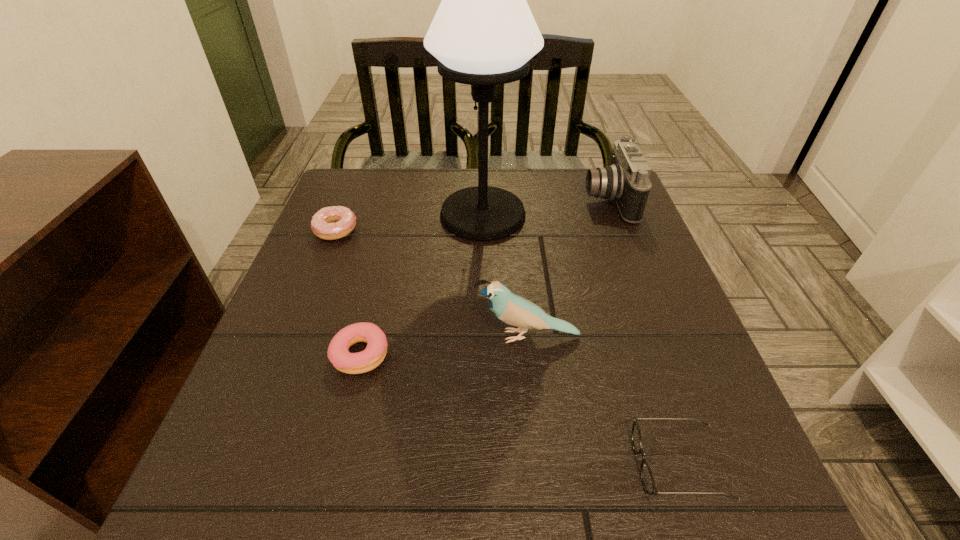
The image size is (960, 540). I want to click on the tallest object, so click(x=483, y=34).

Image resolution: width=960 pixels, height=540 pixels. I want to click on camera, so click(626, 182).

Find the location of a particular element. bird is located at coordinates (514, 310).

You are a GUI agent. You are given a task and a screenshot of the screen. Output one action in this format:
    pyautogui.click(x=<x>, y=<y>)
    Task: Click on the leftmost object
    The image size is (960, 540).
    Given the screenshot: What is the action you would take?
    pyautogui.click(x=322, y=224)

Where is `the farther doughnut`? This screenshot has height=540, width=960. the farther doughnut is located at coordinates (322, 224).

Image resolution: width=960 pixels, height=540 pixels. Identify the location of the right doughnut. (351, 363).

At what (x,y) coordinates should I click in order to perform the action: click on the fifth object from right to left. Please return your answer as a coordinate pair (x, y). This screenshot has width=960, height=540. Looking at the image, I should click on (351, 363).

Locate an element on the screen. spectacles is located at coordinates (648, 482).

Where is `vacant space located on the front of the table lamp`? This screenshot has height=540, width=960. vacant space located on the front of the table lamp is located at coordinates (484, 369).

Find the location of a particular element. vacant area situated 0.290m on the front-facing side of the camera is located at coordinates (474, 200).